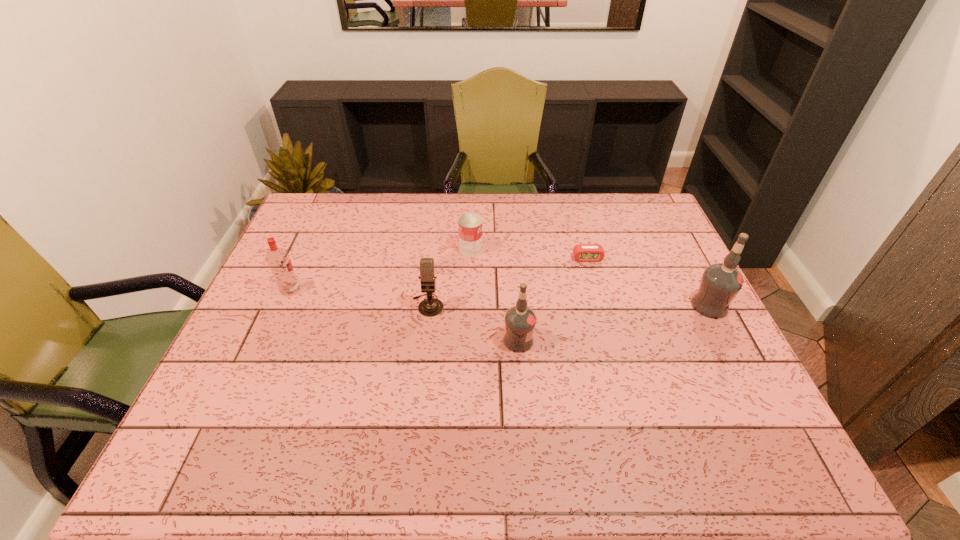
Please point out where to position a new vodka on the left to maintain spacing. Please provide its 2D coordinates. Your answer should be formatted as a tuple, i.e. [(x, y)], where the tuple contains the x and y coordinates of a point satisfying the conditions above.

[(295, 381)]